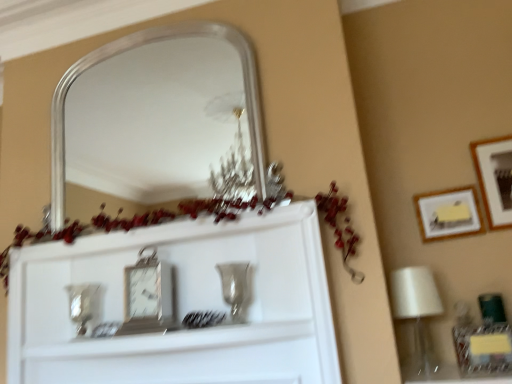
What is the approximate height of white glossy lampshade at right?

white glossy lampshade at right is 15.19 inches in height.

This screenshot has height=384, width=512. What are the coordinates of `white glossy lampshade at right` in the screenshot? It's located at (417, 310).

What do you see at coordinates (448, 214) in the screenshot? The image size is (512, 384). I see `matte yellow paper at upper right, which is the 1th picture frame in left-to-right order` at bounding box center [448, 214].

This screenshot has width=512, height=384. Describe the element at coordinates (180, 305) in the screenshot. I see `metallic silver clock at center` at that location.

What do you see at coordinates (153, 122) in the screenshot?
I see `silver/metallic mirror at upper center` at bounding box center [153, 122].

Measure the distance between silver/metallic mirror at upper center and camera.

silver/metallic mirror at upper center and camera are 2.50 meters apart from each other.

Where is `wooden framed picture at right, which is counted as the 1th picture frame, starting from the right`? The image size is (512, 384). wooden framed picture at right, which is counted as the 1th picture frame, starting from the right is located at coordinates (495, 178).

Which object is positioned more to the left, metallic rectangular clock at center or white glossy lampshade at right?

Positioned to the left is metallic rectangular clock at center.

From a real-world perspective, between metallic rectangular clock at center and white glossy lampshade at right, who is vertically lower?

white glossy lampshade at right is physically lower.

Can you confirm if metallic rectangular clock at center is thinner than white glossy lampshade at right?

Yes.

Is white glossy lampshade at right at the back of metallic rectangular clock at center?

No.

From a real-world perspective, which is physically above, silver/metallic mirror at upper center or wooden framed picture at right, which is the 2th picture frame in left-to-right order?

silver/metallic mirror at upper center.

From the image's perspective, is silver/metallic mirror at upper center on wooden framed picture at right, which is the 2th picture frame in left-to-right order?

Yes.

In the image, is silver/metallic mirror at upper center on the left side or the right side of wooden framed picture at right, which is counted as the 1th picture frame, starting from the right?

silver/metallic mirror at upper center is to the left of wooden framed picture at right, which is counted as the 1th picture frame, starting from the right.

Would you say matte yellow paper at upper right, the 2th picture frame when ordered from right to left, contains silver/metallic mirror at upper center?

No, silver/metallic mirror at upper center is not a part of matte yellow paper at upper right, the 2th picture frame when ordered from right to left.

How distant is matte yellow paper at upper right, the 2th picture frame when ordered from right to left, from silver/metallic mirror at upper center?

matte yellow paper at upper right, the 2th picture frame when ordered from right to left, is 7.90 feet away from silver/metallic mirror at upper center.

Consider the image. Is the position of matte yellow paper at upper right, the 2th picture frame when ordered from right to left, more distant than that of silver/metallic mirror at upper center?

That is True.

Consider the image. Which of these two, matte yellow paper at upper right, which is the 1th picture frame in left-to-right order, or silver/metallic mirror at upper center, is wider?

silver/metallic mirror at upper center is wider.

From a real-world perspective, between wooden framed picture at right, which is the 2th picture frame in left-to-right order, and silver/metallic mirror at upper center, who is vertically higher?

In real-world perspective, silver/metallic mirror at upper center is above.

Considering the sizes of objects wooden framed picture at right, which is counted as the 1th picture frame, starting from the right, and silver/metallic mirror at upper center in the image provided, who is smaller, wooden framed picture at right, which is counted as the 1th picture frame, starting from the right, or silver/metallic mirror at upper center?

wooden framed picture at right, which is counted as the 1th picture frame, starting from the right.

Is wooden framed picture at right, which is the 2th picture frame in left-to-right order, looking in the opposite direction of silver/metallic mirror at upper center?

No, wooden framed picture at right, which is the 2th picture frame in left-to-right order, is not facing the opposite direction of silver/metallic mirror at upper center.

Between wooden framed picture at right, which is counted as the 1th picture frame, starting from the right, and silver/metallic mirror at upper center, which one appears on the left side from the viewer's perspective?

From the viewer's perspective, silver/metallic mirror at upper center appears more on the left side.

From the image's perspective, is metallic silver clock at center positioned above or below matte yellow paper at upper right, the 2th picture frame when ordered from right to left?

metallic silver clock at center is situated lower than matte yellow paper at upper right, the 2th picture frame when ordered from right to left, in the image.

Considering the relative sizes of metallic silver clock at center and matte yellow paper at upper right, which is the 1th picture frame in left-to-right order, in the image provided, is metallic silver clock at center wider than matte yellow paper at upper right, which is the 1th picture frame in left-to-right order,?

Yes.

Is metallic silver clock at center at the right side of matte yellow paper at upper right, which is the 1th picture frame in left-to-right order?

No, metallic silver clock at center is not to the right of matte yellow paper at upper right, which is the 1th picture frame in left-to-right order.

How many degrees apart are the facing directions of metallic silver clock at center and matte yellow paper at upper right, which is the 1th picture frame in left-to-right order?

1.93 degrees.

Is metallic silver clock at center facing away from metallic rectangular clock at center?

Yes, metallic silver clock at center is facing away from metallic rectangular clock at center.

Does metallic silver clock at center come behind metallic rectangular clock at center?

No, metallic silver clock at center is in front of metallic rectangular clock at center.

Can you confirm if metallic silver clock at center is wider than metallic rectangular clock at center?

Incorrect, the width of metallic silver clock at center does not surpass that of metallic rectangular clock at center.

From the image's perspective, between metallic silver clock at center and metallic rectangular clock at center, which one is located above?

From the image's view, metallic rectangular clock at center is above.

Which object is positioned more to the left, white glossy lampshade at right or metallic silver clock at center?

Positioned to the left is metallic silver clock at center.

Is white glossy lampshade at right thinner than metallic silver clock at center?

No.

From the image's perspective, which one is positioned higher, white glossy lampshade at right or metallic silver clock at center?

metallic silver clock at center is shown above in the image.

How much distance is there between white glossy lampshade at right and metallic silver clock at center?

A distance of 76.75 centimeters exists between white glossy lampshade at right and metallic silver clock at center.

Image resolution: width=512 pixels, height=384 pixels. What are the coordinates of `lamp below the metallic rectangular clock at center (from a real-world perspective)` in the screenshot? It's located at (417, 310).

Find the location of a particular element. the 1st picture frame below the silver/metallic mirror at upper center (from the image's perspective) is located at coordinates (495, 178).

Considering their positions, is silver/metallic mirror at upper center positioned closer to metallic rectangular clock at center than white glossy lampshade at right?

white glossy lampshade at right.

Considering their positions, is metallic silver clock at center positioned further to white glossy lampshade at right than wooden framed picture at right, which is counted as the 1th picture frame, starting from the right?

metallic silver clock at center is further to white glossy lampshade at right.

From the image, which object appears to be nearer to metallic rectangular clock at center, silver/metallic mirror at upper center or matte yellow paper at upper right, which is the 1th picture frame in left-to-right order?

matte yellow paper at upper right, which is the 1th picture frame in left-to-right order, is closer to metallic rectangular clock at center.

When comparing their distances from metallic rectangular clock at center, does wooden framed picture at right, which is counted as the 1th picture frame, starting from the right, or metallic silver clock at center seem further?

wooden framed picture at right, which is counted as the 1th picture frame, starting from the right, is positioned further to the anchor metallic rectangular clock at center.

From the picture: Which object lies further to the anchor point metallic rectangular clock at center, metallic silver clock at center or wooden framed picture at right, which is the 2th picture frame in left-to-right order?

wooden framed picture at right, which is the 2th picture frame in left-to-right order, lies further to metallic rectangular clock at center than the other object.

Looking at this image, estimate the real-world distances between objects in this image. Which object is closer to matte yellow paper at upper right, the 2th picture frame when ordered from right to left, metallic rectangular clock at center or metallic silver clock at center?

metallic silver clock at center is positioned closer to the anchor matte yellow paper at upper right, the 2th picture frame when ordered from right to left.

Estimate the real-world distances between objects in this image. Which object is closer to metallic silver clock at center, matte yellow paper at upper right, the 2th picture frame when ordered from right to left, or white glossy lampshade at right?

white glossy lampshade at right.

Based on their spatial positions, is metallic silver clock at center or white glossy lampshade at right closer to metallic rectangular clock at center?

metallic silver clock at center lies closer to metallic rectangular clock at center than the other object.

Where is `lamp situated between metallic silver clock at center and wooden framed picture at right, which is counted as the 1th picture frame, starting from the right, from left to right`? The height and width of the screenshot is (384, 512). lamp situated between metallic silver clock at center and wooden framed picture at right, which is counted as the 1th picture frame, starting from the right, from left to right is located at coordinates (x=417, y=310).

Identify the location of lamp between metallic rectangular clock at center and matte yellow paper at upper right, which is the 1th picture frame in left-to-right order, in the horizontal direction. The height and width of the screenshot is (384, 512). (417, 310).

At what (x,y) coordinates should I click in order to perform the action: click on picture frame between wooden framed picture at right, which is the 2th picture frame in left-to-right order, and white glossy lampshade at right vertically. Please return your answer as a coordinate pair (x, y). Image resolution: width=512 pixels, height=384 pixels. Looking at the image, I should click on (448, 214).

Locate an element on the screen. Image resolution: width=512 pixels, height=384 pixels. cabinet between metallic rectangular clock at center and wooden framed picture at right, which is counted as the 1th picture frame, starting from the right is located at coordinates (180, 305).